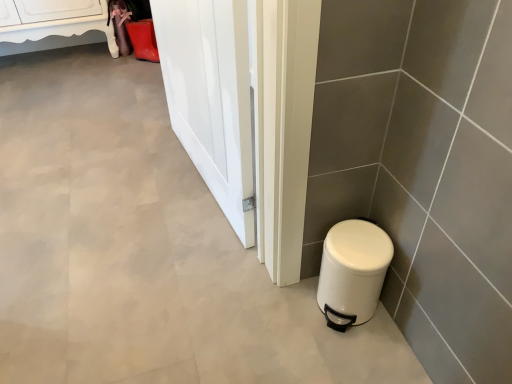
Question: Does white glossy cabinet at upper left come behind white glossy door at center?

Choices:
 (A) yes
 (B) no

Answer: (A)

Question: From a real-world perspective, is white glossy cabinet at upper left physically above white glossy door at center?

Choices:
 (A) no
 (B) yes

Answer: (A)

Question: From a real-world perspective, is white glossy cabinet at upper left under white glossy door at center?

Choices:
 (A) no
 (B) yes

Answer: (B)

Question: Is white glossy cabinet at upper left taller than white glossy door at center?

Choices:
 (A) no
 (B) yes

Answer: (A)

Question: From the image's perspective, is white glossy cabinet at upper left below white glossy door at center?

Choices:
 (A) yes
 (B) no

Answer: (B)

Question: Is white glossy cabinet at upper left to the left of white glossy door at center from the viewer's perspective?

Choices:
 (A) yes
 (B) no

Answer: (A)

Question: Can white matte trash can at lower right be found inside white glossy cabinet at upper left?

Choices:
 (A) yes
 (B) no

Answer: (B)

Question: Considering the relative positions of white glossy cabinet at upper left and white matte trash can at lower right in the image provided, is white glossy cabinet at upper left in front of white matte trash can at lower right?

Choices:
 (A) yes
 (B) no

Answer: (B)

Question: From a real-world perspective, is white glossy cabinet at upper left positioned under white matte trash can at lower right based on gravity?

Choices:
 (A) yes
 (B) no

Answer: (B)

Question: Is white glossy cabinet at upper left wider than white matte trash can at lower right?

Choices:
 (A) no
 (B) yes

Answer: (B)

Question: Considering the relative positions of white glossy cabinet at upper left and white matte trash can at lower right in the image provided, is white glossy cabinet at upper left behind white matte trash can at lower right?

Choices:
 (A) yes
 (B) no

Answer: (A)

Question: Considering the relative sizes of white glossy cabinet at upper left and white matte trash can at lower right in the image provided, is white glossy cabinet at upper left thinner than white matte trash can at lower right?

Choices:
 (A) yes
 (B) no

Answer: (B)

Question: Does white glossy door at center touch white glossy cabinet at upper left?

Choices:
 (A) no
 (B) yes

Answer: (A)